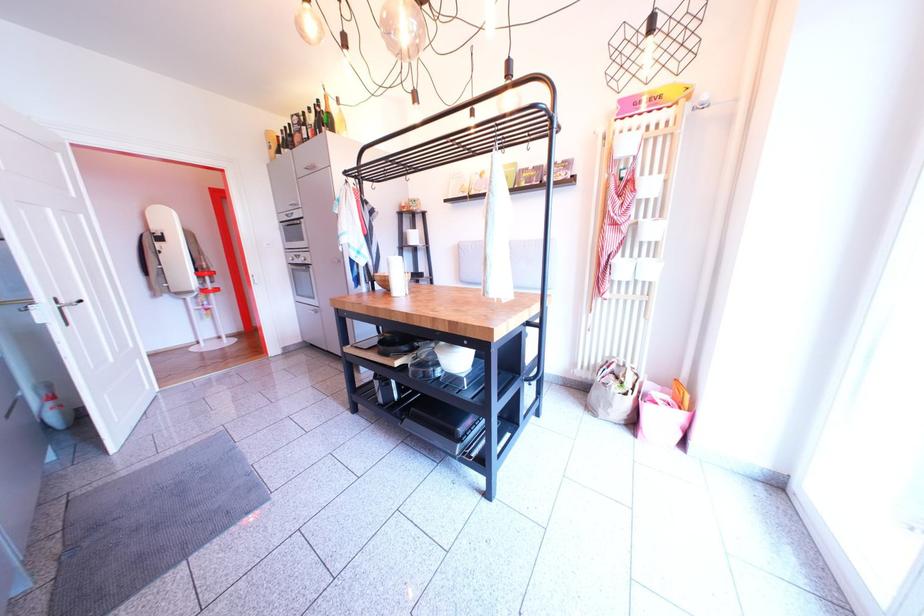
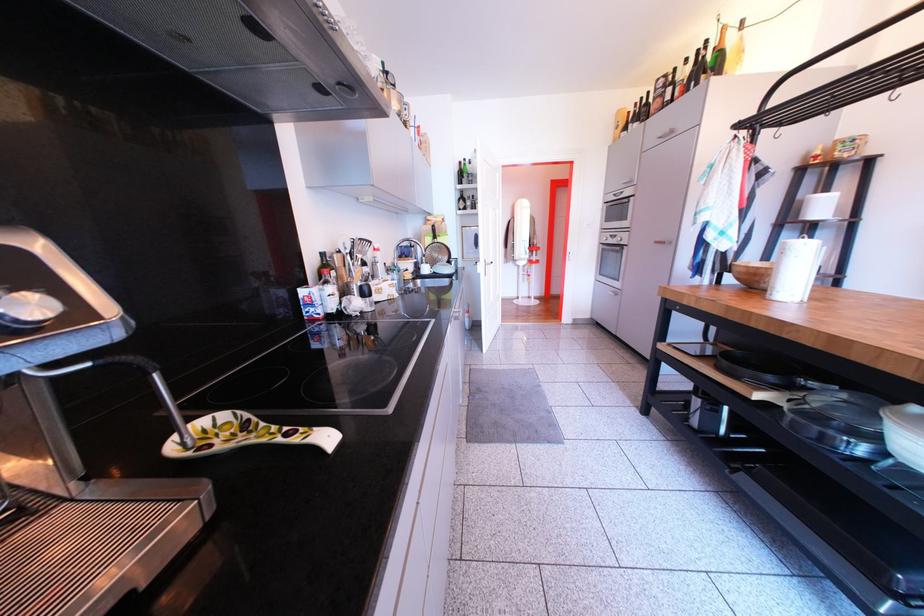
In the second image, find the point that corresponds to (392,353) in the first image.

(736, 369)